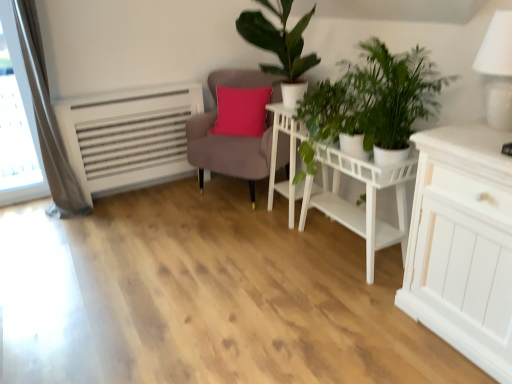
The width and height of the screenshot is (512, 384). Find the location of `vacant area situated below green leafy plant at center right, which ranks as the second houseplant in back-to-front order (from a real-world perspective)`. vacant area situated below green leafy plant at center right, which ranks as the second houseplant in back-to-front order (from a real-world perspective) is located at coordinates (357, 285).